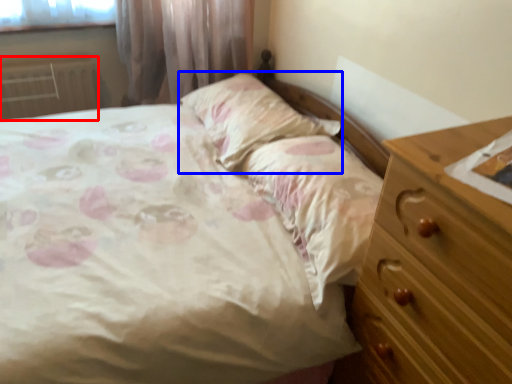
Question: Which of the following is the closest to the observer, radiator (highlighted by a red box) or pillow (highlighted by a blue box)?

Choices:
 (A) radiator
 (B) pillow

Answer: (B)